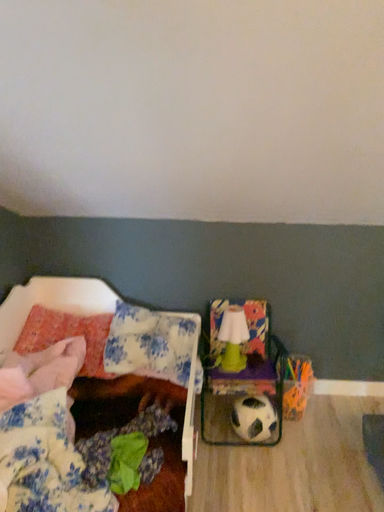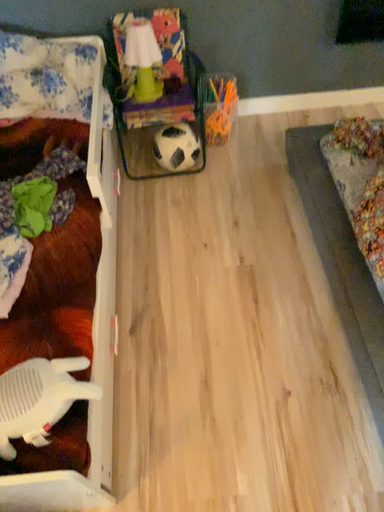
Question: How did the camera likely rotate when shooting the video?

Choices:
 (A) rotated left
 (B) rotated right

Answer: (B)